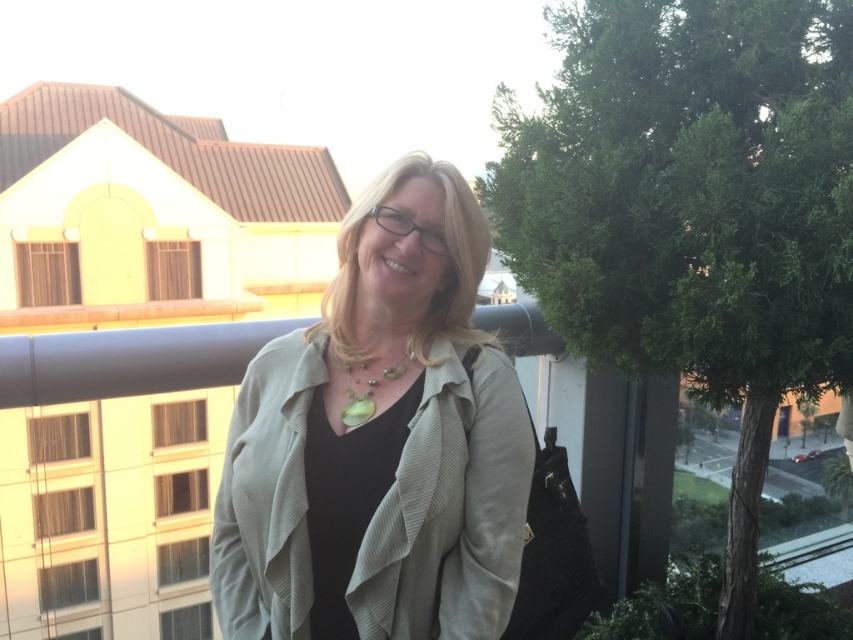
Question: In this image, where is green leafy tree at right located relative to matte beige jacket at center?

Choices:
 (A) above
 (B) below

Answer: (A)

Question: Which point is closer to the camera?

Choices:
 (A) green leafy tree at right
 (B) matte beige jacket at center

Answer: (B)

Question: Does green leafy tree at right appear on the right side of matte beige jacket at center?

Choices:
 (A) no
 (B) yes

Answer: (B)

Question: Which point appears farthest from the camera in this image?

Choices:
 (A) (428, 493)
 (B) (363, 397)

Answer: (B)

Question: Which point appears farthest from the camera in this image?

Choices:
 (A) (387, 378)
 (B) (335, 534)
 (C) (849, 328)

Answer: (C)

Question: Does matte beige jacket at center appear on the left side of green pearl necklace at center?

Choices:
 (A) no
 (B) yes

Answer: (A)